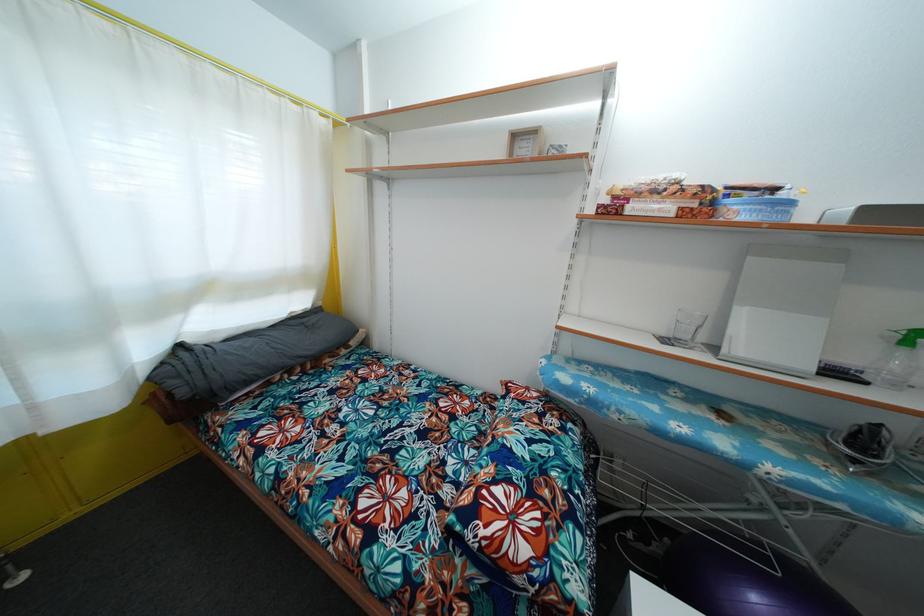
At what (x,y) coordinates should I click in order to perform the action: click on clear drinking glass. Please return your answer as a coordinate pair (x, y). The height and width of the screenshot is (616, 924). Looking at the image, I should click on (687, 328).